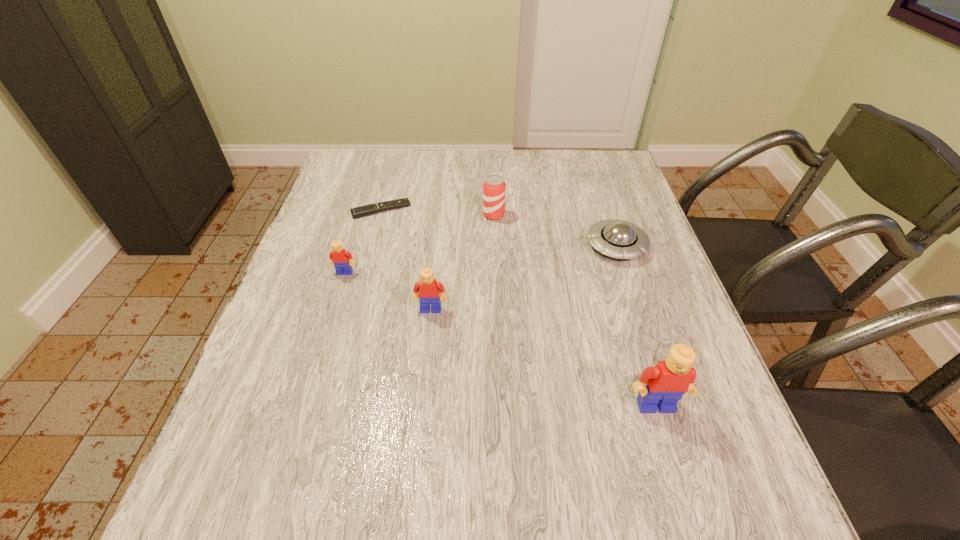
Locate an element on the screen. The height and width of the screenshot is (540, 960). free location that satisfies the following two spatial constraints: 1. on the front side of the fourth nearest object; 2. on the right side of the fourth object from left to right is located at coordinates (495, 246).